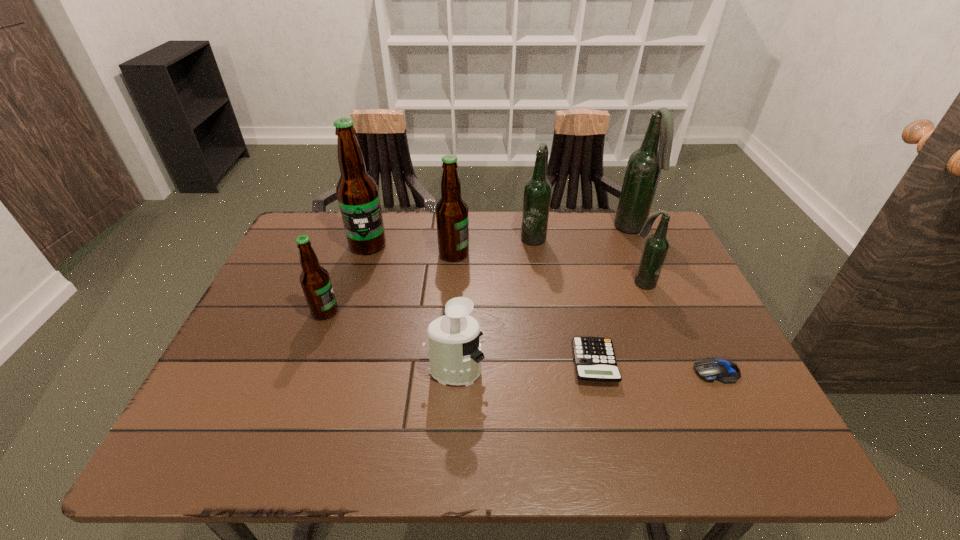
What are the coordinates of `free location that satisfies the following two spatial constraints: 1. on the label of the juicer; 2. on the left side of the fourth beer bottle from right to left` in the screenshot? It's located at (445, 372).

Image resolution: width=960 pixels, height=540 pixels. What are the coordinates of `vacant area in the image that satisfies the following two spatial constraints: 1. on the label of the biggest brown beer bottle; 2. on the left side of the sixth object from left to right` in the screenshot? It's located at (331, 363).